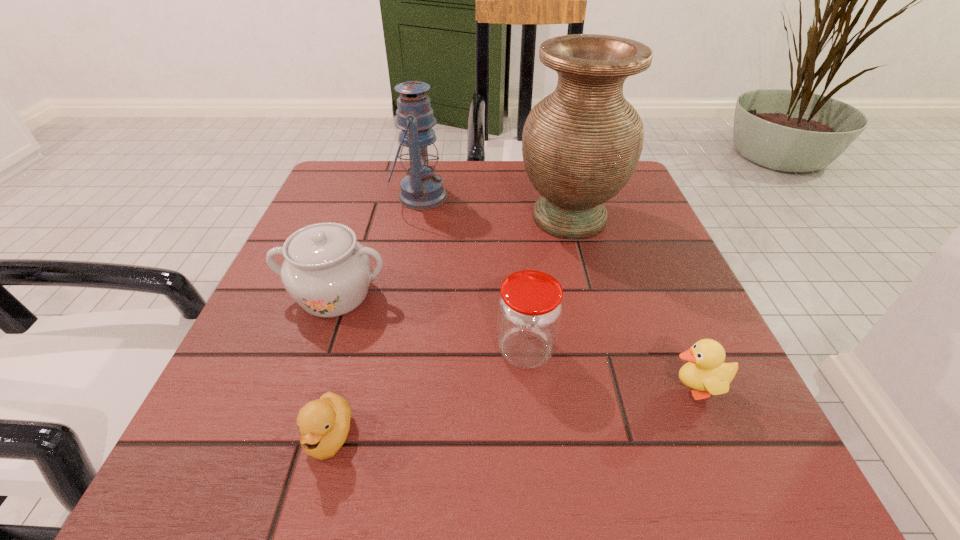
Locate an element on the screen. the fifth closest object to the jar is located at coordinates (421, 189).

In order to click on free location that satisfies the following two spatial constraints: 1. on the back side of the jar; 2. on the right side of the tallest object in this screenshot , I will do `click(513, 218)`.

Find the location of a particular element. vacant point that satisfies the following two spatial constraints: 1. on the front-facing side of the fifth tallest object; 2. on the face of the left duckling is located at coordinates (715, 437).